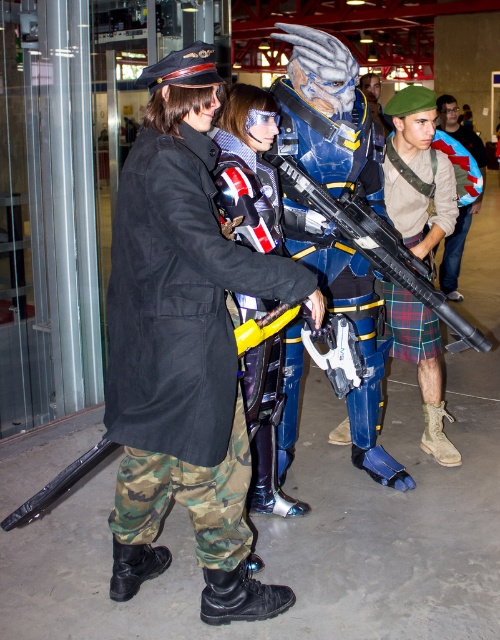
Question: Does shiny metallic armor at center come in front of matte black rifle at center?

Choices:
 (A) yes
 (B) no

Answer: (A)

Question: Which point is farther to the camera?

Choices:
 (A) (220, 136)
 (B) (358, 168)
 (C) (444, 113)

Answer: (C)

Question: Does shiny metallic armor at center appear on the left side of matte black rifle at center?

Choices:
 (A) no
 (B) yes

Answer: (B)

Question: Can you confirm if camouflage fabric pants at left is wider than shiny blue armor at center?

Choices:
 (A) yes
 (B) no

Answer: (B)

Question: Estimate the real-world distances between objects in this image. Which object is farther from the matte black rifle at center?

Choices:
 (A) shiny metallic armor at center
 (B) camouflage pants at center

Answer: (B)

Question: Which object is closer to the camera taking this photo?

Choices:
 (A) camouflage pants at center
 (B) matte black rifle at center
 (C) camouflage fabric pants at left

Answer: (C)